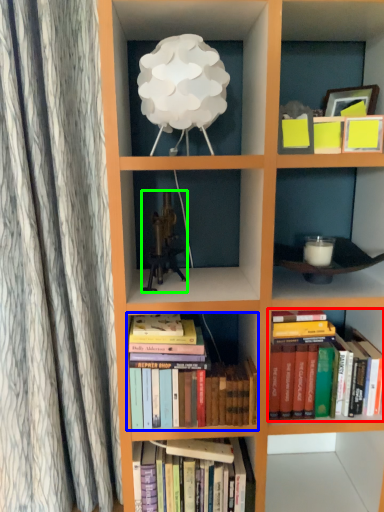
Question: Estimate the real-world distances between objects in this image. Which object is closer to book (highlighted by a red box), book (highlighted by a blue box) or toy (highlighted by a green box)?

Choices:
 (A) book
 (B) toy

Answer: (A)